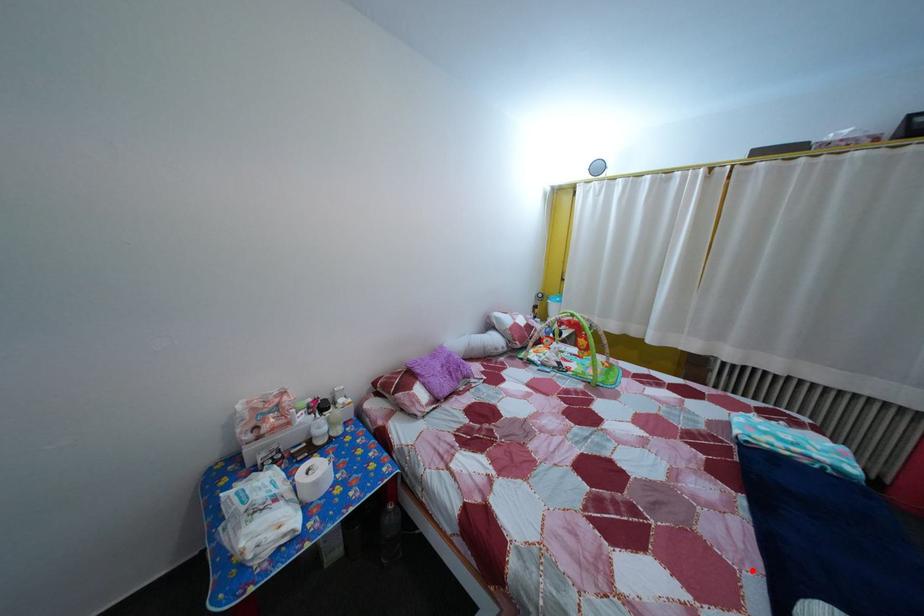
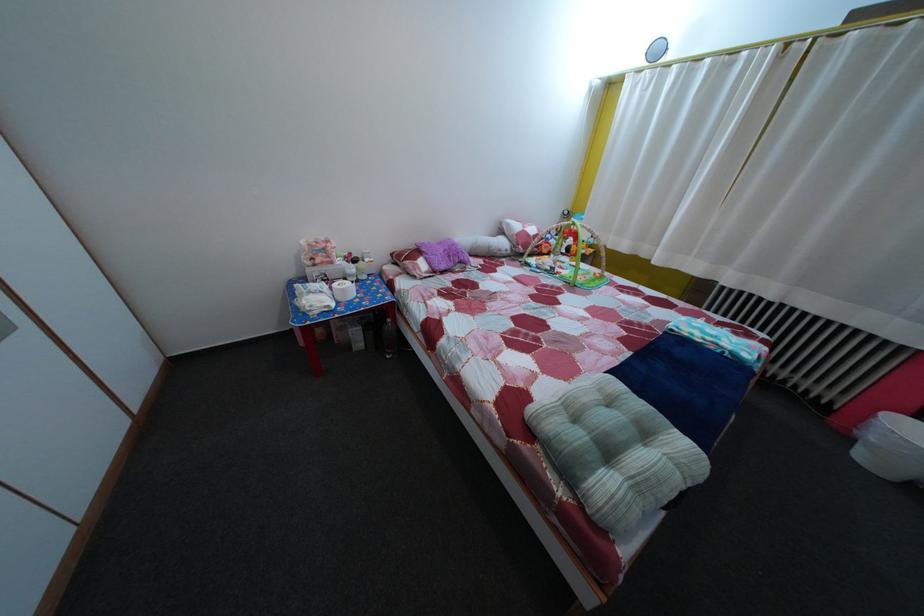
Question: I am providing you with two images of the same scene from different viewpoints. Given a red point in image1, look at the same physical point in image2. Is it:

Choices:
 (A) Closer to the viewpoint
 (B) Farther from the viewpoint

Answer: (A)